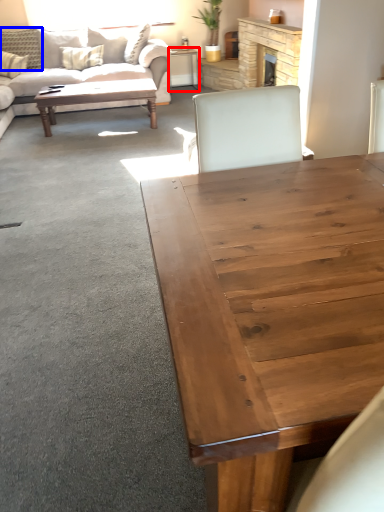
Question: Which of the following is the closest to the observer, desk (highlighted by a red box) or pillow (highlighted by a blue box)?

Choices:
 (A) desk
 (B) pillow

Answer: (B)